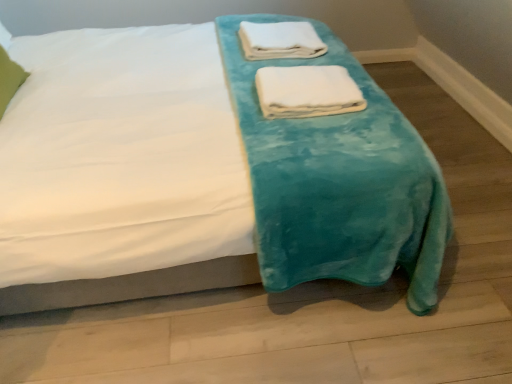
Question: From a real-world perspective, relative to teal plush blanket at center, is white soft towel at upper center, which is the 2th towel from front to back, vertically above or below?

Choices:
 (A) below
 (B) above

Answer: (B)

Question: Looking at their shapes, would you say white soft towel at upper center, the second towel when ordered from bottom to top, is wider or thinner than teal plush blanket at center?

Choices:
 (A) thin
 (B) wide

Answer: (A)

Question: Which object is the farthest from the white soft towel at upper center, which is the 2th towel from front to back?

Choices:
 (A) white soft towel at center, the 1th towel when ordered from front to back
 (B) teal plush blanket at center
 (C) green fabric pillow at upper left

Answer: (C)

Question: Considering the real-world distances, which object is farthest from the green fabric pillow at upper left?

Choices:
 (A) white soft towel at center, which ranks as the 1th towel in bottom-to-top order
 (B) white soft towel at upper center, the 1th towel in the back-to-front sequence
 (C) teal plush blanket at center

Answer: (A)